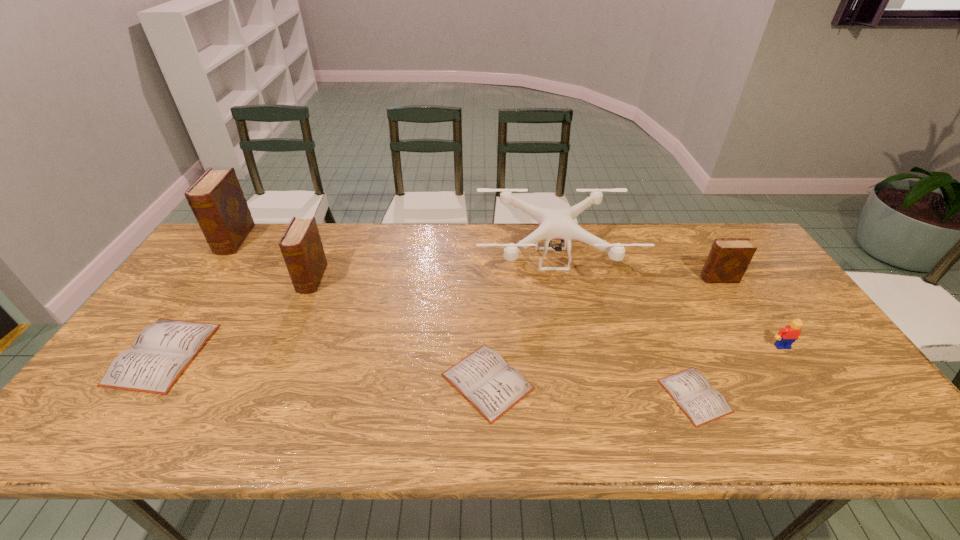
The height and width of the screenshot is (540, 960). I want to click on free spot located 0.060m on the face of the fifth tallest object, so click(x=797, y=368).

Where is `free point located 0.270m on the back of the sixth tallest object`? The image size is (960, 540). free point located 0.270m on the back of the sixth tallest object is located at coordinates (228, 258).

You are a GUI agent. You are given a task and a screenshot of the screen. Output one action in this format:
    pyautogui.click(x=<x>, y=<y>)
    Task: Click on the free space located 0.310m on the back of the second white diary from right to left
    
    Given the screenshot: What is the action you would take?
    pyautogui.click(x=486, y=269)

You are a GUI agent. You are given a task and a screenshot of the screen. Output one action in this format:
    pyautogui.click(x=<x>, y=<y>)
    Task: Click on the vacant point located on the back of the shortest diary
    The width and height of the screenshot is (960, 540).
    Given the screenshot: What is the action you would take?
    pyautogui.click(x=651, y=293)

Locate an element on the screen. This screenshot has height=540, width=960. drone at the far edge is located at coordinates (554, 224).

The height and width of the screenshot is (540, 960). In order to click on diary that is at the right edge in this screenshot , I will do `click(728, 259)`.

The image size is (960, 540). Identify the location of Lego positioned at the right edge. (786, 336).

In order to click on object at the far left corner in this screenshot , I will do [x=217, y=201].

Locate an element on the screen. This screenshot has width=960, height=540. free point at the far edge is located at coordinates (362, 255).

Identify the location of vacant position at the near edge of the desktop. This screenshot has width=960, height=540. (292, 426).